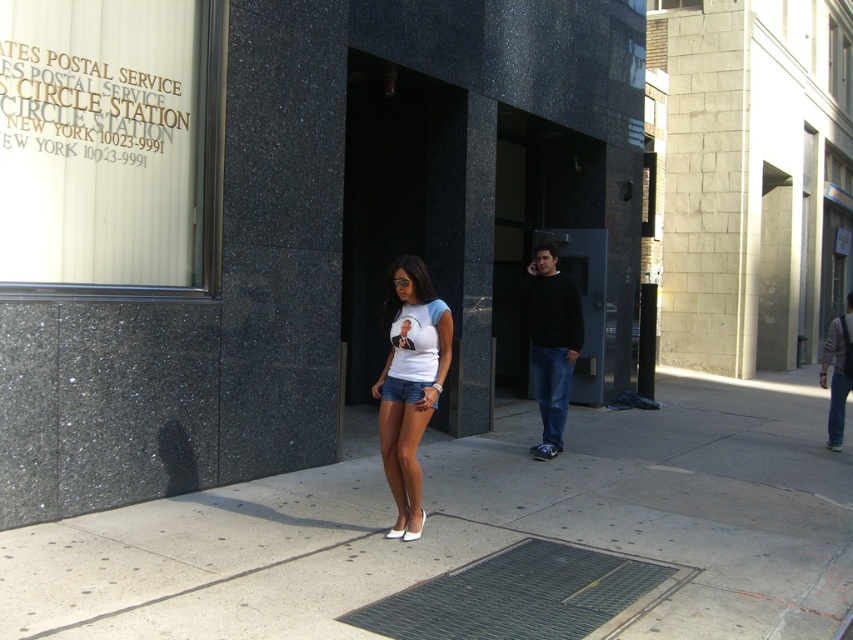
Who is lower down, concrete sidewalk at center or black cotton sweater at center?

concrete sidewalk at center is below.

Which is behind, point (282, 541) or point (544, 292)?

Positioned behind is point (544, 292).

At what (x,y) coordinates should I click in order to perform the action: click on concrete sidewalk at center. Please return your answer as a coordinate pair (x, y). Looking at the image, I should click on (479, 528).

Based on the photo, which is below, black cotton sweater at center or white matte t-shirt at center?

Positioned lower is black cotton sweater at center.

Does point (579, 300) come farther from viewer compared to point (427, 376)?

Yes, point (579, 300) is farther from viewer.

Where is `black cotton sweater at center`? This screenshot has height=640, width=853. black cotton sweater at center is located at coordinates (550, 342).

Which of these two, black cotton sweater at center or denim shorts at center, stands taller?

black cotton sweater at center is taller.

Which is behind, point (569, 321) or point (403, 387)?

The point (569, 321) is behind.

Is point (567, 346) positioned before point (389, 385)?

No, (567, 346) is further to viewer.

Locate an element on the screen. The image size is (853, 640). black cotton sweater at center is located at coordinates (550, 342).